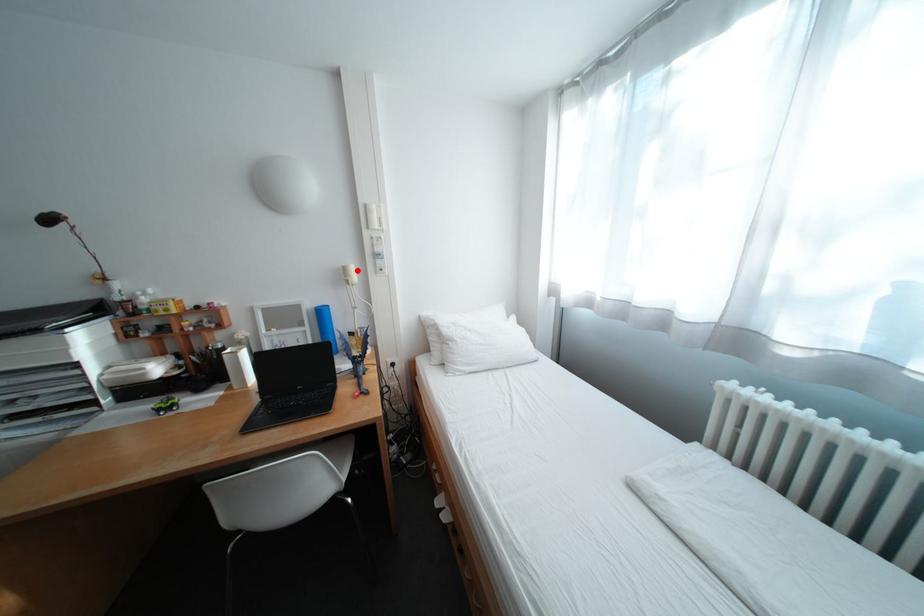
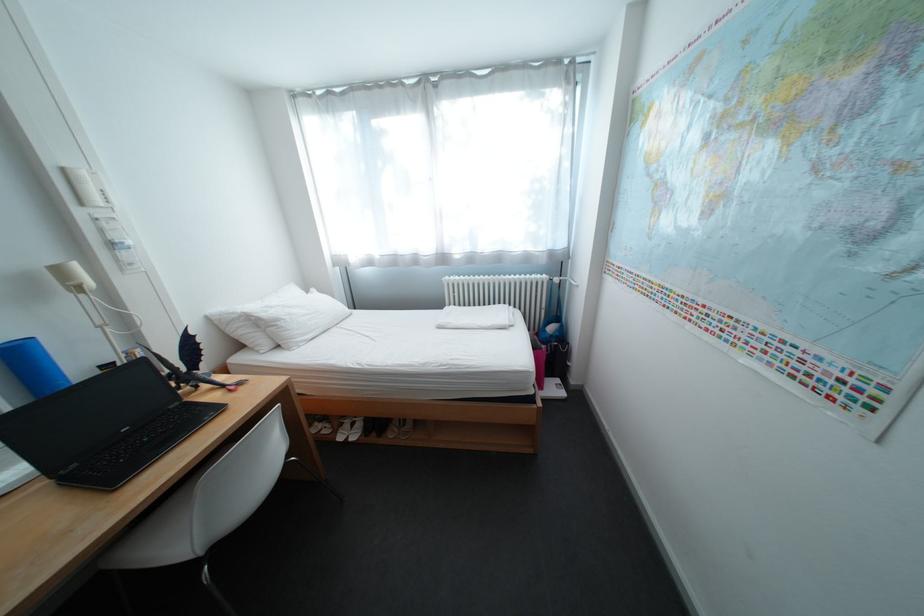
Locate, in the second image, the point that corresponds to the highlighted location in the first image.

(71, 272)